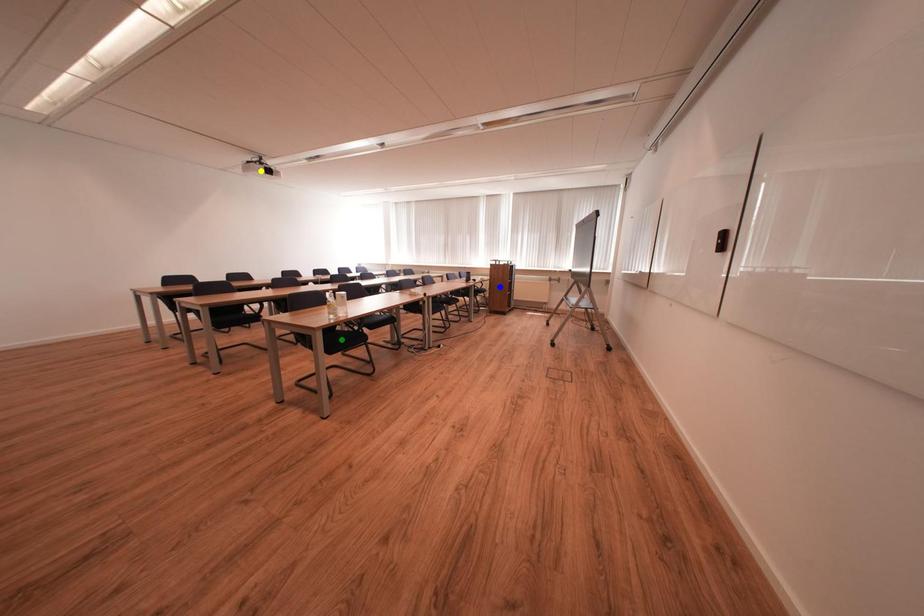
Order these from nearest to farthest:
- blue point
- yellow point
- green point

blue point < yellow point < green point